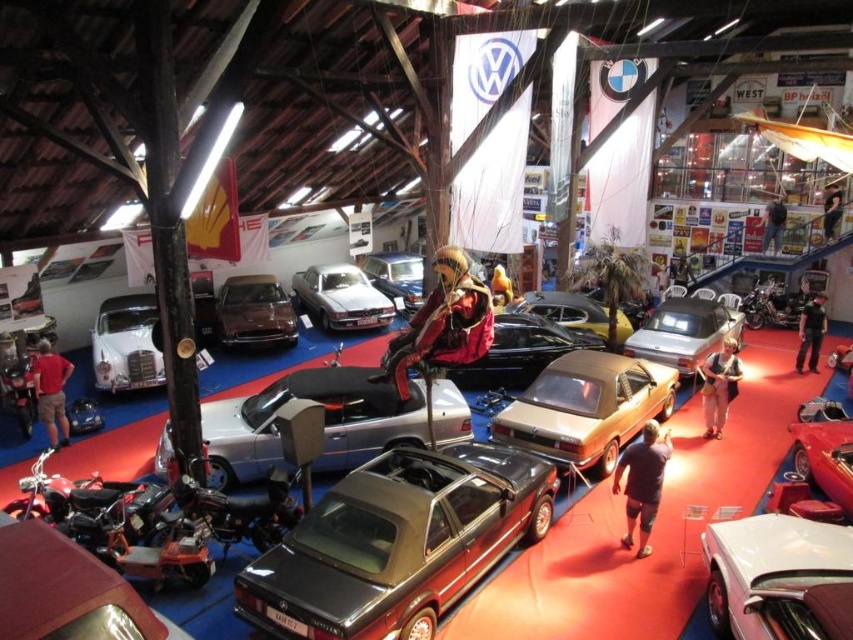
Question: Which of the following is the closest to the observer?

Choices:
 (A) (515, 378)
 (B) (222, 346)
 (C) (56, 509)
 (D) (579, 321)

Answer: (C)

Question: Estimate the real-world distances between objects in this image. Which object is farther from the white glossy car at lower right?

Choices:
 (A) metallic silver convertible at center
 (B) metallic dark gray convertible at center
 (C) satin silver car at center

Answer: (C)

Question: Can you confirm if white glossy car at lower right is positioned above shiny metallic car at center?

Choices:
 (A) no
 (B) yes

Answer: (A)

Question: Does shiny metallic motorcycle at lower left have a greater width compared to matte silver convertible at center?

Choices:
 (A) no
 (B) yes

Answer: (A)

Question: Considering the real-world distances, which object is farthest from the shiny chrome motorcycle at lower left?

Choices:
 (A) white glossy car at lower right
 (B) shiny metallic car at center-left
 (C) silver metallic convertible at center

Answer: (B)

Question: Is silver metallic convertible at center positioned in front of white glossy car at lower right?

Choices:
 (A) yes
 (B) no

Answer: (B)